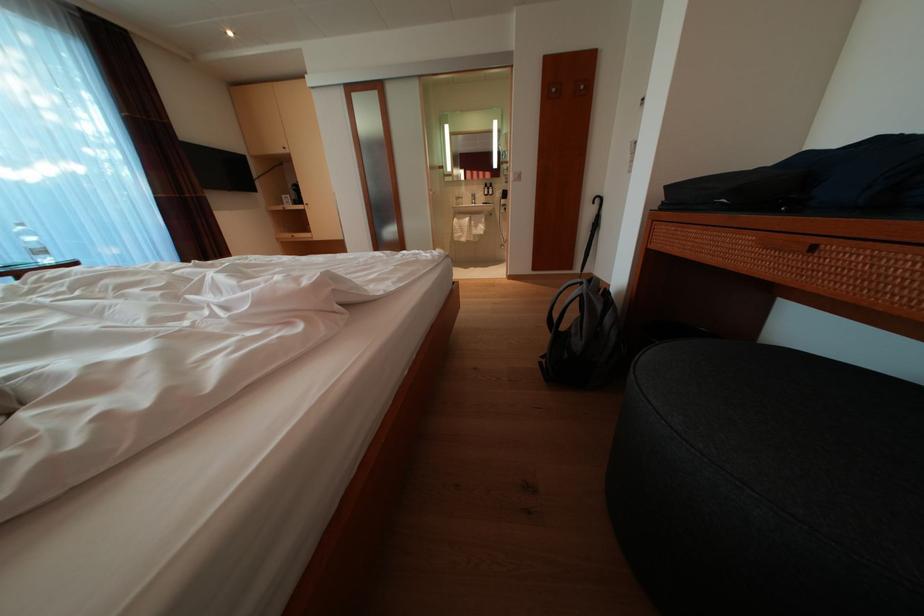
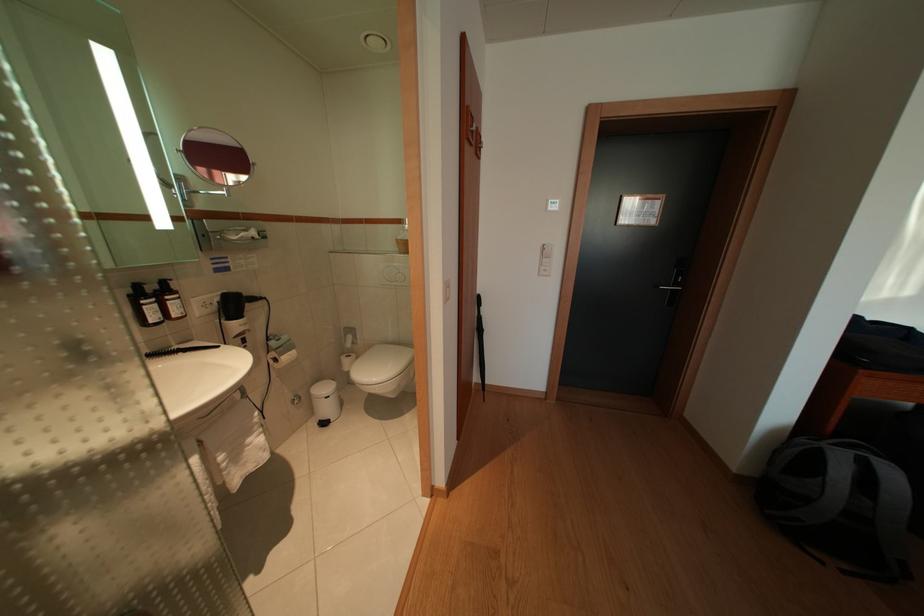
Locate, in the second image, the point that corresponds to point 494,197 in the first image.

(159, 315)